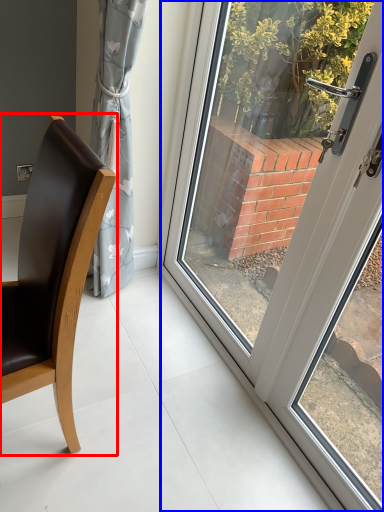
Question: Among these objects, which one is farthest to the camera, chair (highlighted by a red box) or door (highlighted by a blue box)?

Choices:
 (A) chair
 (B) door

Answer: (A)